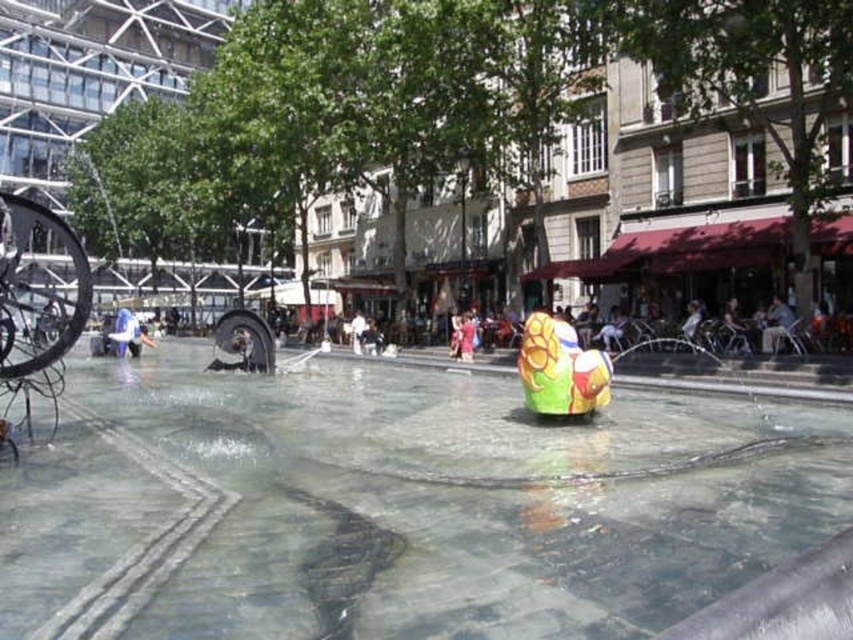
You are a visitor in the plaza and want to place a small, lightweight object on the glossy plastic toy at center without it falling into the clear glass water at center. How should you position the object?

Place the object on the glossy plastic toy at center carefully, ensuring it stays above the clear glass water at center since the glossy plastic toy at center is positioned over the clear glass water at center.

Based on the photo, you are a photographer standing in the plaza and want to capture both the clear glass water at center and the matte pink dress at center in a single shot. Which object will occupy more space in your photo?

The clear glass water at center is bigger than the matte pink dress at center, so it will occupy more space in the photo.